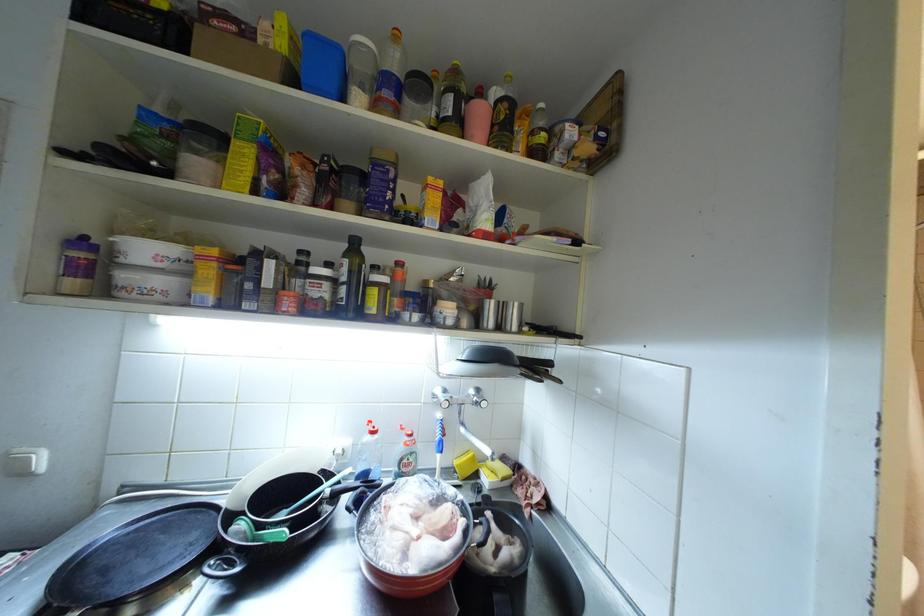
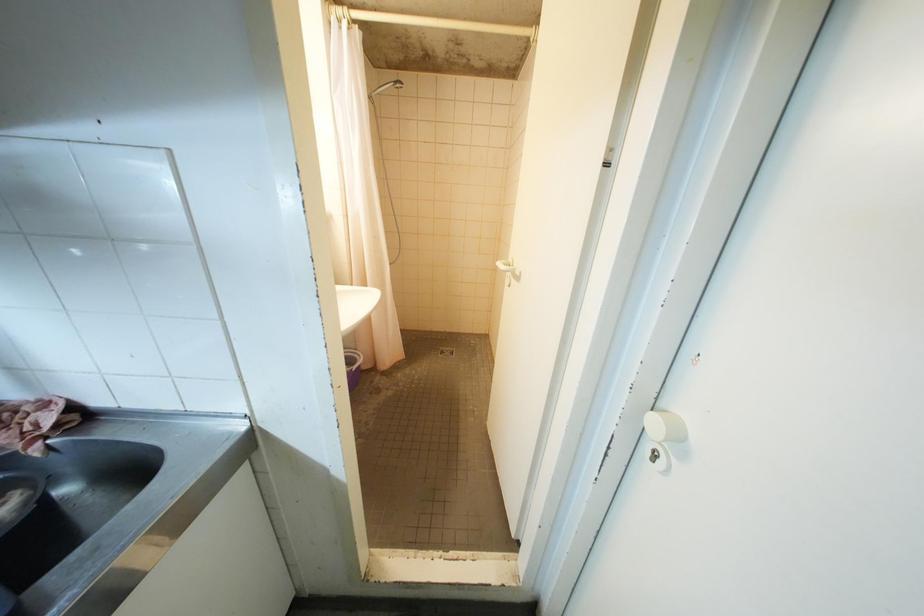
First-person continuous shooting, in which direction is the camera rotating?

The camera rotated toward right-down.